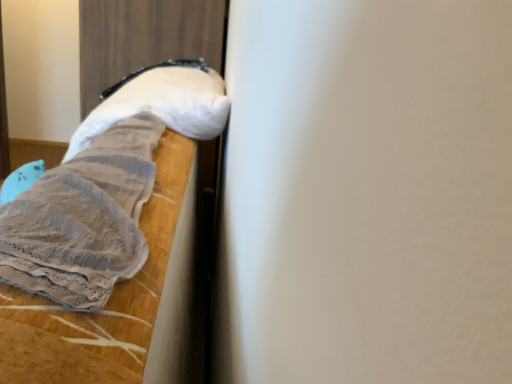
Where is `white fluffy pillow at upper left`? The height and width of the screenshot is (384, 512). white fluffy pillow at upper left is located at coordinates (162, 102).

Describe the element at coordinates (162, 102) in the screenshot. I see `white fluffy pillow at upper left` at that location.

The height and width of the screenshot is (384, 512). Describe the element at coordinates (105, 188) in the screenshot. I see `gray textured fabric at left` at that location.

Locate an element on the screen. The image size is (512, 384). gray textured fabric at left is located at coordinates (105, 188).

Locate an element on the screen. Image resolution: width=512 pixels, height=384 pixels. white fluffy pillow at upper left is located at coordinates (162, 102).

Is white fluffy pillow at upper left to the left of gray textured fabric at left from the viewer's perspective?

Yes.

Which is behind, white fluffy pillow at upper left or gray textured fabric at left?

white fluffy pillow at upper left is further from the camera.

Which is in front, point (116, 116) or point (146, 98)?

Positioned in front is point (116, 116).

From the image's perspective, which is below, white fluffy pillow at upper left or gray textured fabric at left?

gray textured fabric at left is shown below in the image.

From a real-world perspective, is white fluffy pillow at upper left positioned over gray textured fabric at left based on gravity?

Yes, from a real-world perspective, white fluffy pillow at upper left is on top of gray textured fabric at left.

Does white fluffy pillow at upper left have a lesser width compared to gray textured fabric at left?

No, white fluffy pillow at upper left is not thinner than gray textured fabric at left.

Between white fluffy pillow at upper left and gray textured fabric at left, which one has less height?

white fluffy pillow at upper left.

Can you confirm if white fluffy pillow at upper left is smaller than gray textured fabric at left?

No.

Is white fluffy pillow at upper left not inside gray textured fabric at left?

white fluffy pillow at upper left is positioned outside gray textured fabric at left.

Is white fluffy pillow at upper left positioned far away from gray textured fabric at left?

No, there isn't a large distance between white fluffy pillow at upper left and gray textured fabric at left.

Is white fluffy pillow at upper left facing away from gray textured fabric at left?

No, gray textured fabric at left is not at the back of white fluffy pillow at upper left.

Locate an element on the screen. The image size is (512, 384). footwear above the gray textured fabric at left (from the image's perspective) is located at coordinates (162, 102).

Can you confirm if gray textured fabric at left is positioned to the left of white fluffy pillow at upper left?

Incorrect, gray textured fabric at left is not on the left side of white fluffy pillow at upper left.

Looking at this image, considering the positions of objects gray textured fabric at left and white fluffy pillow at upper left in the image provided, who is in front, gray textured fabric at left or white fluffy pillow at upper left?

gray textured fabric at left is in front.

Which is farther from the camera, (72, 221) or (135, 109)?

The point (135, 109) is behind.

From the image's perspective, is gray textured fabric at left located above or below white fluffy pillow at upper left?

gray textured fabric at left is situated lower than white fluffy pillow at upper left in the image.

From a real-world perspective, which object stands above the other?

white fluffy pillow at upper left is physically above.

Considering the sizes of objects gray textured fabric at left and white fluffy pillow at upper left in the image provided, who is wider, gray textured fabric at left or white fluffy pillow at upper left?

With larger width is white fluffy pillow at upper left.

Between gray textured fabric at left and white fluffy pillow at upper left, which one has more height?

Standing taller between the two is gray textured fabric at left.

Can you confirm if gray textured fabric at left is smaller than white fluffy pillow at upper left?

Correct, gray textured fabric at left occupies less space than white fluffy pillow at upper left.

Is gray textured fabric at left situated inside white fluffy pillow at upper left or outside?

gray textured fabric at left is located beyond the bounds of white fluffy pillow at upper left.

Is gray textured fabric at left positioned far away from white fluffy pillow at upper left?

No, gray textured fabric at left is not far from white fluffy pillow at upper left.

Is gray textured fabric at left oriented away from white fluffy pillow at upper left?

No, white fluffy pillow at upper left is not at the back of gray textured fabric at left.

How many degrees apart are the facing directions of gray textured fabric at left and white fluffy pillow at upper left?

The facing directions of gray textured fabric at left and white fluffy pillow at upper left are 0.00113 degrees apart.

You are a GUI agent. You are given a task and a screenshot of the screen. Output one action in this format:
    pyautogui.click(x=<x>, y=<y>)
    Task: Click on the sheet located underneath the white fluffy pillow at upper left (from a real-world perspective)
    This screenshot has height=384, width=512.
    Given the screenshot: What is the action you would take?
    pyautogui.click(x=105, y=188)

This screenshot has width=512, height=384. In order to click on footwear that appears above the gray textured fabric at left (from the image's perspective) in this screenshot , I will do `click(162, 102)`.

At what (x,y) coordinates should I click in order to perform the action: click on footwear on the left of gray textured fabric at left. Please return your answer as a coordinate pair (x, y). This screenshot has width=512, height=384. Looking at the image, I should click on (162, 102).